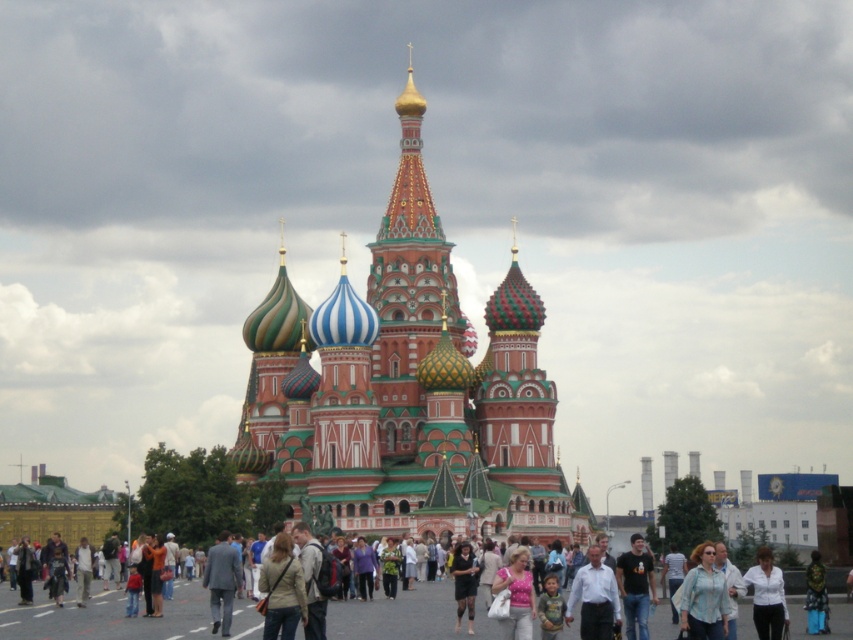
Is multicolored mosaic dome at center bigger than light beige jacket at center?

Indeed, multicolored mosaic dome at center has a larger size compared to light beige jacket at center.

Which is below, multicolored mosaic dome at center or light beige jacket at center?

light beige jacket at center is below.

What do you see at coordinates (405, 390) in the screenshot?
I see `multicolored mosaic dome at center` at bounding box center [405, 390].

Where is `multicolored mosaic dome at center`? The height and width of the screenshot is (640, 853). multicolored mosaic dome at center is located at coordinates (405, 390).

Is multicolored mosaic dome at center closer to camera compared to white matte shirt at center?

That is False.

Is multicolored mosaic dome at center below white matte shirt at center?

Actually, multicolored mosaic dome at center is above white matte shirt at center.

This screenshot has width=853, height=640. I want to click on multicolored mosaic dome at center, so click(x=405, y=390).

Does point (695, 632) come closer to viewer compared to point (758, 592)?

Yes.

Does blue plaid shirt at lower right lie behind white matte shirt at center?

No, blue plaid shirt at lower right is closer to the viewer.

Image resolution: width=853 pixels, height=640 pixels. What do you see at coordinates (703, 596) in the screenshot? I see `blue plaid shirt at lower right` at bounding box center [703, 596].

You are a GUI agent. You are given a task and a screenshot of the screen. Output one action in this format:
    pyautogui.click(x=<x>, y=<y>)
    Task: Click on the blue plaid shirt at lower right
    
    Given the screenshot: What is the action you would take?
    pyautogui.click(x=703, y=596)